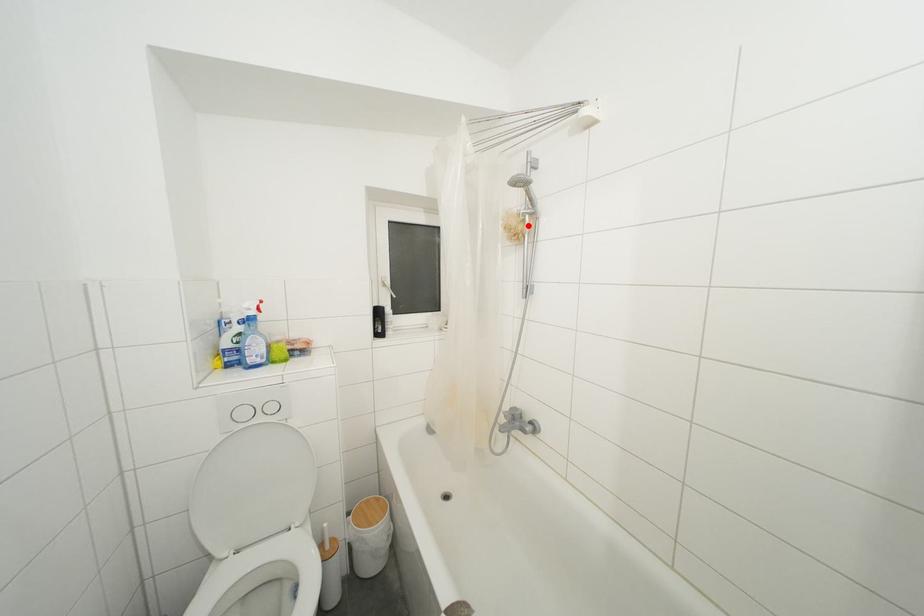
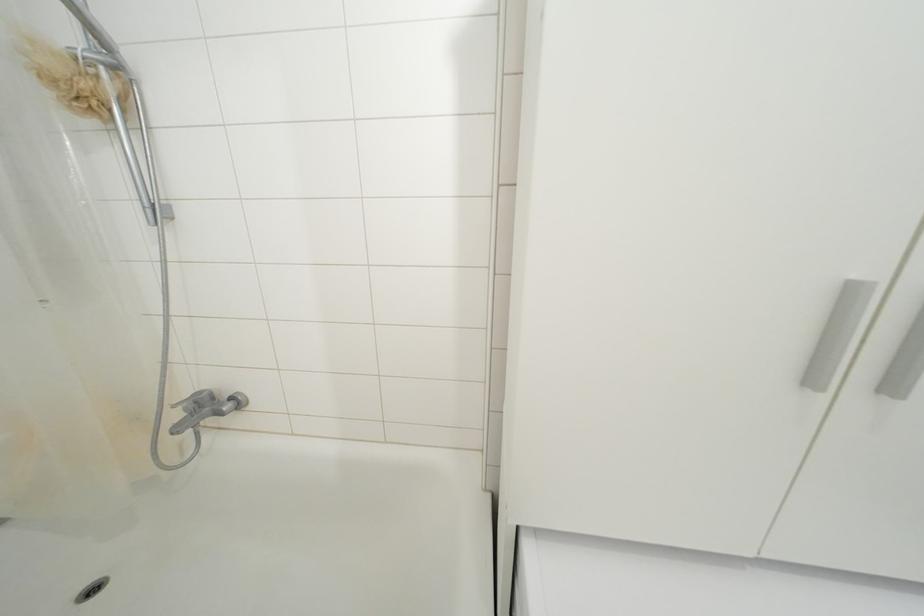
Where in the second image is the point corresponding to the highlighted location from the first image?

(100, 79)